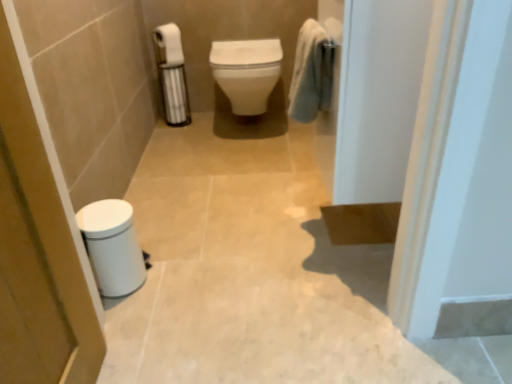
Question: Is white glossy toilet at center located outside soft blue towel at upper right?

Choices:
 (A) no
 (B) yes

Answer: (B)

Question: From a real-world perspective, is white glossy toilet at center over soft blue towel at upper right?

Choices:
 (A) no
 (B) yes

Answer: (A)

Question: Considering the relative positions of white glossy toilet at center and soft blue towel at upper right in the image provided, is white glossy toilet at center to the right of soft blue towel at upper right from the viewer's perspective?

Choices:
 (A) no
 (B) yes

Answer: (A)

Question: Is white glossy toilet at center facing away from soft blue towel at upper right?

Choices:
 (A) yes
 (B) no

Answer: (B)

Question: Is white glossy toilet at center closer to the viewer compared to soft blue towel at upper right?

Choices:
 (A) yes
 (B) no

Answer: (B)

Question: From a real-world perspective, is white matte toilet paper at upper left positioned above or below white matte trash can at lower left, the 2th screen door from the right?

Choices:
 (A) below
 (B) above

Answer: (B)

Question: In the image, is white matte toilet paper at upper left on the left side or the right side of white matte trash can at lower left, positioned as the 1th screen door in left-to-right order?

Choices:
 (A) left
 (B) right

Answer: (B)

Question: From their relative heights in the image, would you say white matte toilet paper at upper left is taller or shorter than white matte trash can at lower left, the 2th screen door from the right?

Choices:
 (A) tall
 (B) short

Answer: (B)

Question: Based on their sizes in the image, would you say white matte toilet paper at upper left is bigger or smaller than white matte trash can at lower left, positioned as the 1th screen door in left-to-right order?

Choices:
 (A) small
 (B) big

Answer: (A)

Question: Is point (109, 259) positioned closer to the camera than point (368, 102)?

Choices:
 (A) farther
 (B) closer

Answer: (A)

Question: From a real-world perspective, is white glossy trash can at lower left physically located above or below white glossy screen door at upper right, which appears as the 2th screen door when viewed from the left?

Choices:
 (A) above
 (B) below

Answer: (B)

Question: Considering the positions of white glossy trash can at lower left and white glossy screen door at upper right, which appears as the 2th screen door when viewed from the left, in the image, is white glossy trash can at lower left bigger or smaller than white glossy screen door at upper right, which appears as the 2th screen door when viewed from the left,?

Choices:
 (A) small
 (B) big

Answer: (A)

Question: From their relative heights in the image, would you say white glossy trash can at lower left is taller or shorter than white glossy screen door at upper right, marked as the 1th screen door in a right-to-left arrangement?

Choices:
 (A) tall
 (B) short

Answer: (B)

Question: In terms of size, does soft blue towel at upper right appear bigger or smaller than white glossy trash can at lower left?

Choices:
 (A) small
 (B) big

Answer: (A)

Question: Considering their positions, is soft blue towel at upper right located in front of or behind white glossy trash can at lower left?

Choices:
 (A) behind
 (B) front

Answer: (B)